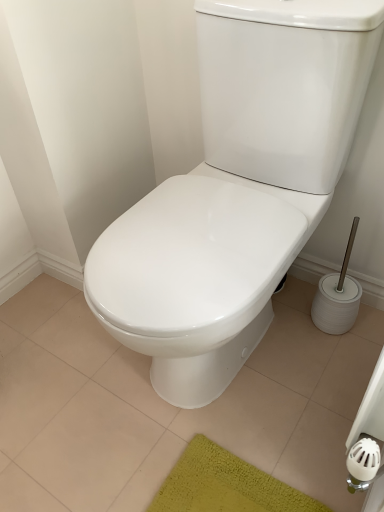
Find the location of a particular element. The height and width of the screenshot is (512, 384). free point above white glossy toilet at center (from a real-world perspective) is located at coordinates (182, 403).